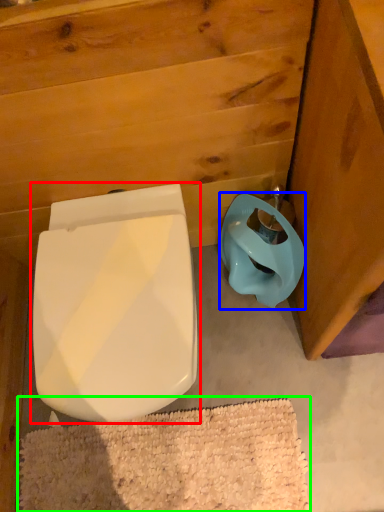
Question: Which object is the farthest from toilet (highlighted by a red box)? Choose among these: toilet bowl (highlighted by a blue box) or bath mat (highlighted by a green box).

Choices:
 (A) toilet bowl
 (B) bath mat

Answer: (B)